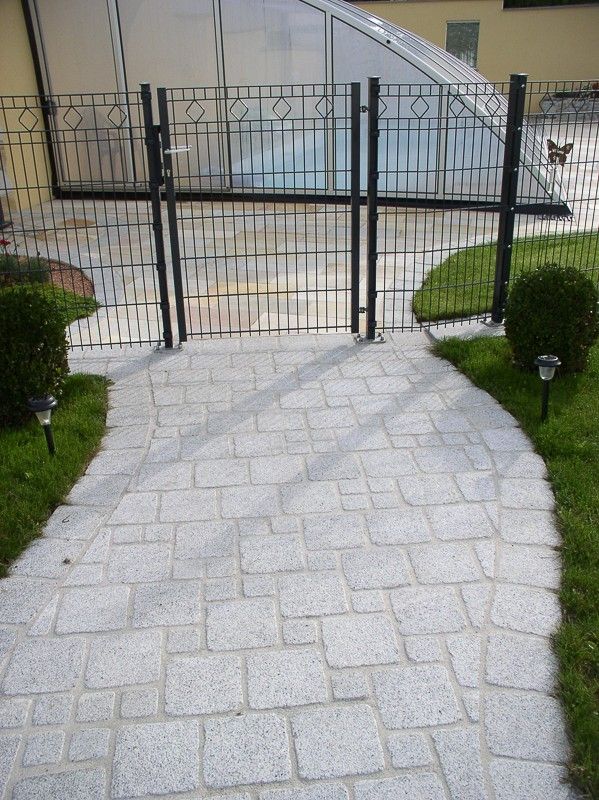
Where is `grout between stones`? grout between stones is located at coordinates (382, 765).